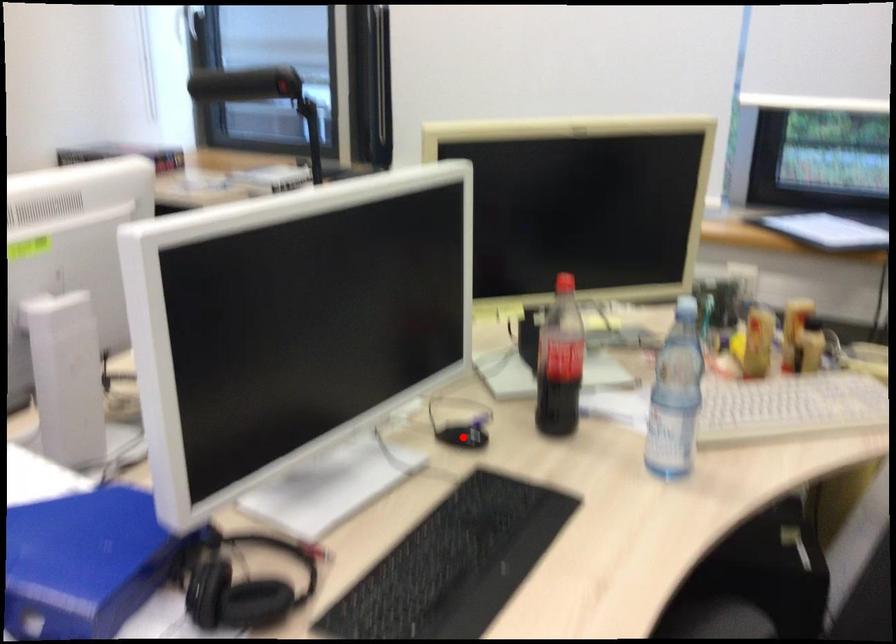
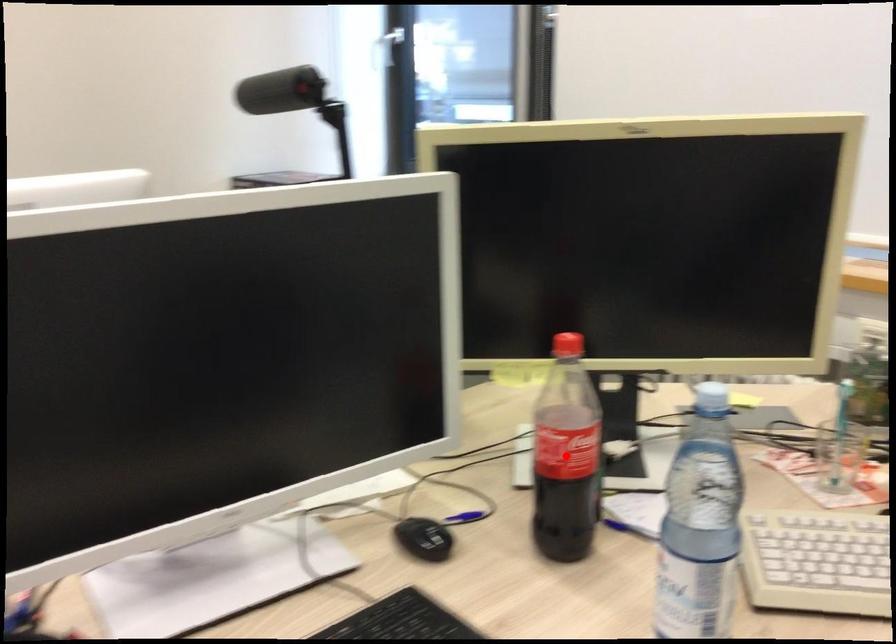
I am providing you with two images of the same scene from different viewpoints. A red point is marked on the first image and another point is marked on the second image. Are the points marked in image1 and image2 representing the same 3D position?

No